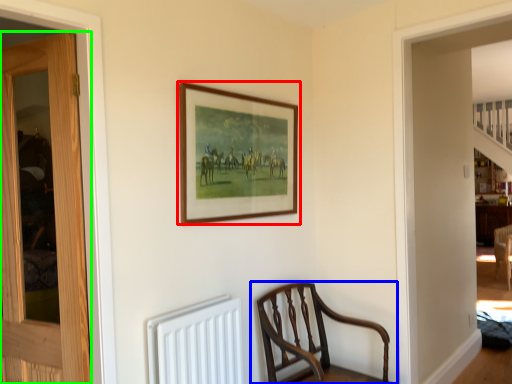
Question: Based on their relative distances, which object is nearer to picture frame (highlighted by a red box)? Choose from chair (highlighted by a blue box) and door (highlighted by a green box).

Choices:
 (A) chair
 (B) door

Answer: (B)